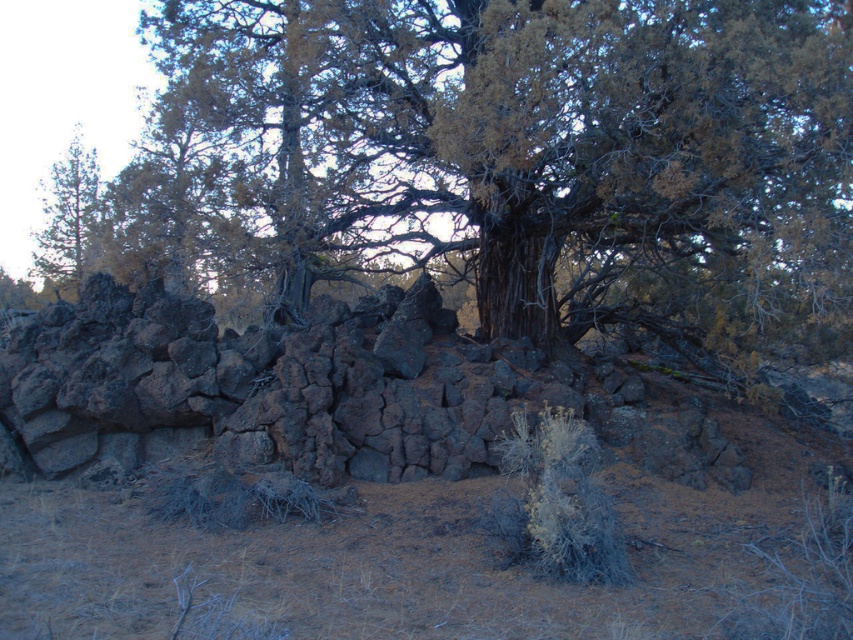
Can you confirm if dark brown bark tree at center is wider than green pine tree at left?

Indeed, dark brown bark tree at center has a greater width compared to green pine tree at left.

Does dark brown bark tree at center appear on the right side of green pine tree at left?

Indeed, dark brown bark tree at center is positioned on the right side of green pine tree at left.

Who is more forward, (194, 148) or (35, 269)?

Point (194, 148)

The height and width of the screenshot is (640, 853). In order to click on dark brown bark tree at center in this screenshot , I will do `click(503, 161)`.